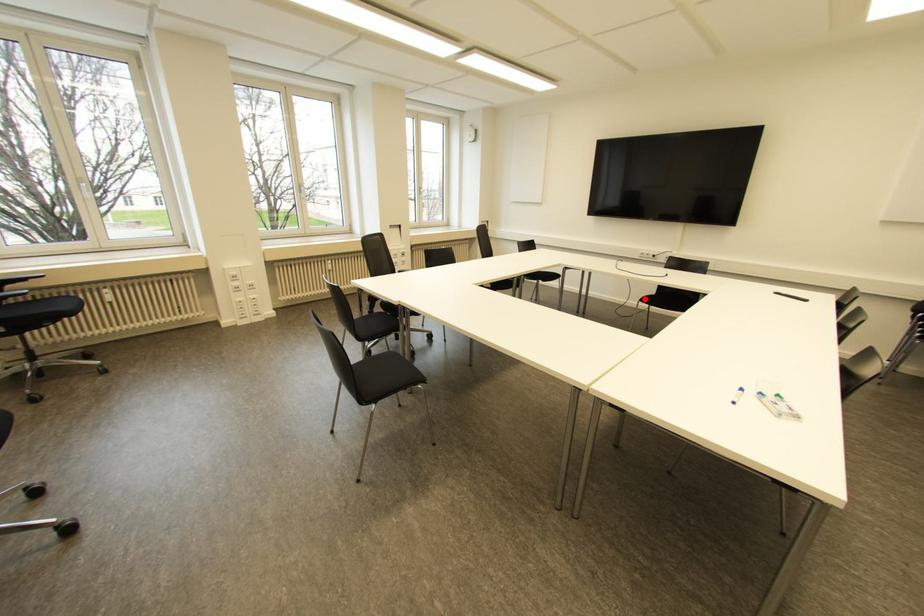
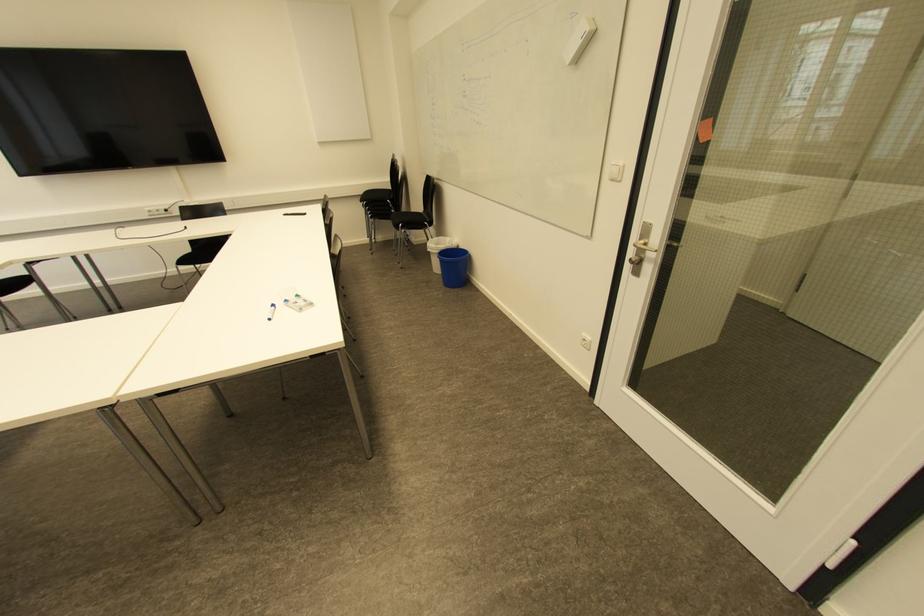
Question: A red point is marked in image1. In image2, is the corresponding 3D point closer to the camera or farther? Reply with the corresponding letter.

Choices:
 (A) The corresponding 3D point is closer.
 (B) The corresponding 3D point is farther.

Answer: (B)